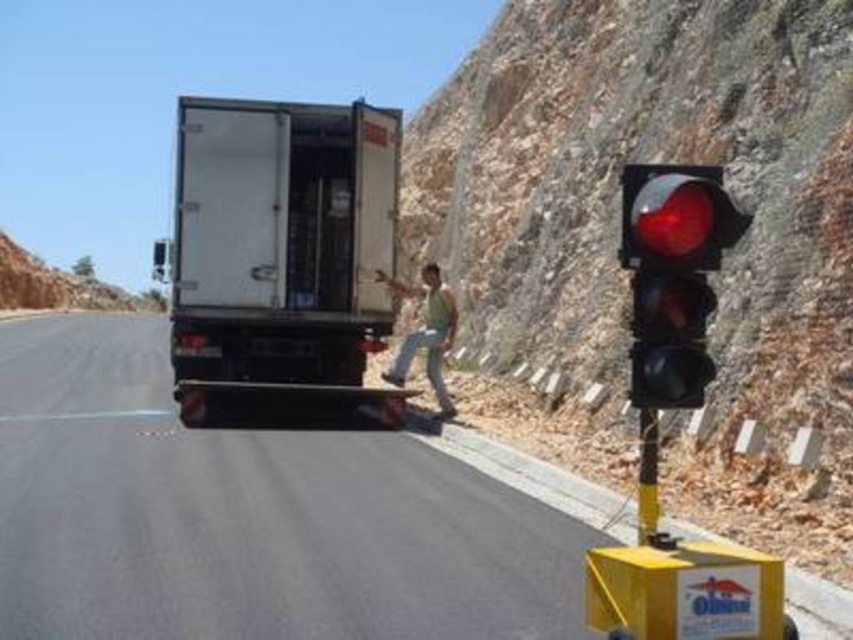
Between black rubber road at center and green fabric shirt at center, which one appears on the right side from the viewer's perspective?

Positioned to the right is green fabric shirt at center.

Between point (303, 588) and point (438, 330), which one is positioned in front?

Positioned in front is point (303, 588).

You are a GUI agent. You are given a task and a screenshot of the screen. Output one action in this format:
    pyautogui.click(x=<x>, y=<y>)
    Task: Click on the black rubber road at center
    The image size is (853, 640).
    Given the screenshot: What is the action you would take?
    pyautogui.click(x=259, y=513)

At what (x,y) coordinates should I click in order to perform the action: click on white matte trailer truck at center. Please return your answer as a coordinate pair (x, y). Looking at the image, I should click on coord(281,250).

Does white matte trailer truck at center appear on the right side of red plastic traffic light at right?

No, white matte trailer truck at center is not to the right of red plastic traffic light at right.

Identify the location of white matte trailer truck at center. This screenshot has width=853, height=640. (281, 250).

Is point (383, 186) closer to viewer compared to point (408, 285)?

Yes, point (383, 186) is closer to viewer.

Is white matte trailer truck at center positioned in front of green fabric shirt at center?

Yes, it is.

Image resolution: width=853 pixels, height=640 pixels. What do you see at coordinates (281, 250) in the screenshot?
I see `white matte trailer truck at center` at bounding box center [281, 250].

You are a GUI agent. You are given a task and a screenshot of the screen. Output one action in this format:
    pyautogui.click(x=<x>, y=<y>)
    Task: Click on the white matte trailer truck at center
    
    Given the screenshot: What is the action you would take?
    pyautogui.click(x=281, y=250)